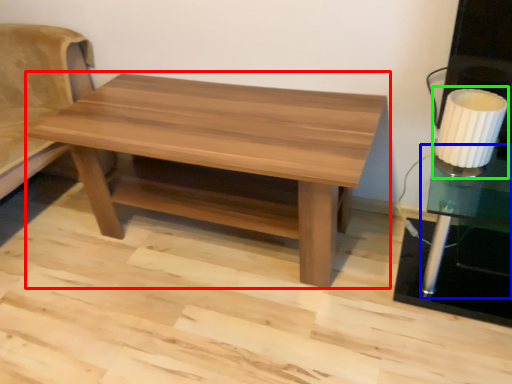
Question: Estimate the real-world distances between objects in this image. Which object is farther from coffee table (highlighted by a red box), side table (highlighted by a blue box) or table lamp (highlighted by a green box)?

Choices:
 (A) side table
 (B) table lamp

Answer: (A)